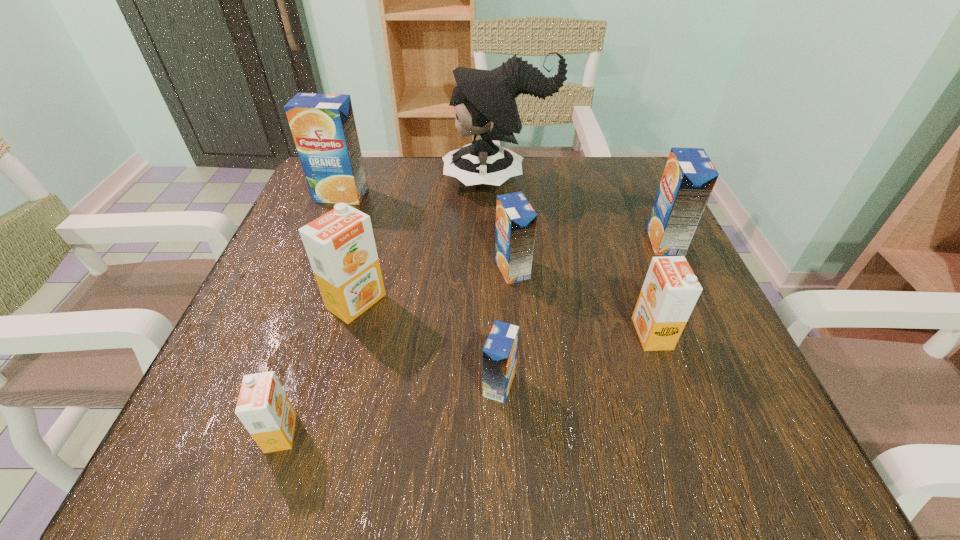
The height and width of the screenshot is (540, 960). Find the location of `free space located 0.090m on the front of the rightmost orange orange juice`. free space located 0.090m on the front of the rightmost orange orange juice is located at coordinates (677, 403).

Where is `free region located 0.050m on the right of the nearest blue orange_juice`? free region located 0.050m on the right of the nearest blue orange_juice is located at coordinates (550, 384).

Identify the location of vacant space located on the back of the smallest orange orange juice. The width and height of the screenshot is (960, 540). (299, 382).

You are a GUI agent. You are given a task and a screenshot of the screen. Output one action in this format:
    pyautogui.click(x=<x>, y=<y>)
    Task: Click on the doll that is positioned at the far edge
    This screenshot has width=960, height=540.
    Given the screenshot: What is the action you would take?
    pyautogui.click(x=484, y=101)

Where is `orange_juice that is at the far edge`? orange_juice that is at the far edge is located at coordinates (323, 126).

Locate an element on the screen. The width and height of the screenshot is (960, 540). object at the near edge is located at coordinates (263, 407).

Where is `object located at the far left corner`? Image resolution: width=960 pixels, height=540 pixels. object located at the far left corner is located at coordinates (323, 126).

Locate an element on the screen. This screenshot has height=540, width=960. object present at the near left corner is located at coordinates (263, 407).

Find the location of a particular element. Image resolution: width=960 pixels, height=540 pixels. free space at the far edge of the desktop is located at coordinates (449, 213).

In the image, there is a desktop. Identify the location of vacant space at the near edge. (312, 433).